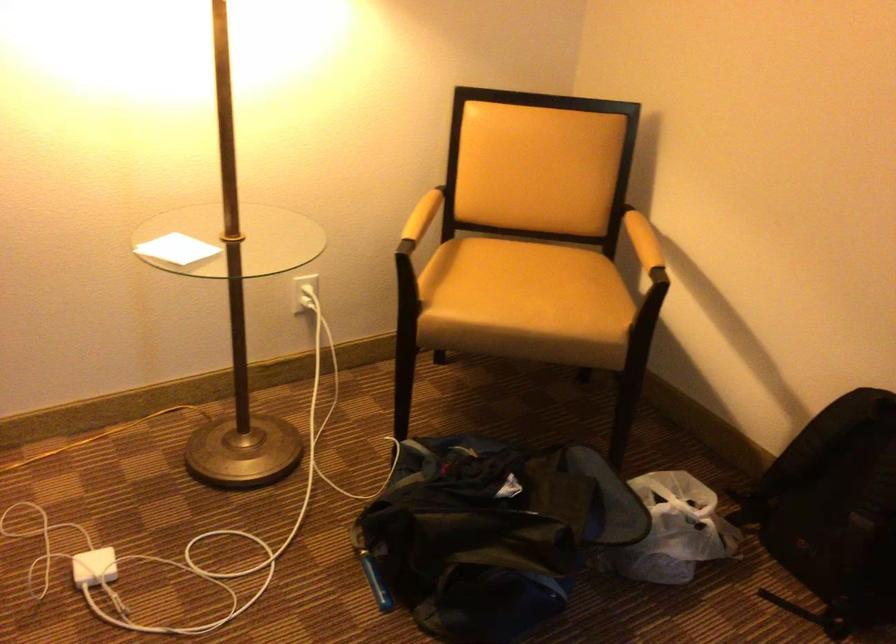
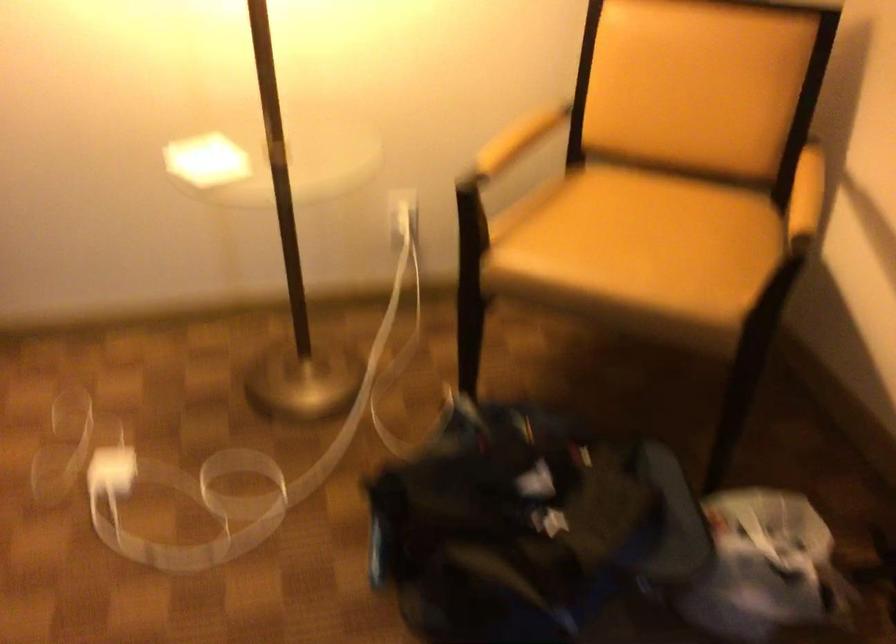
Question: How did the camera likely rotate?

Choices:
 (A) Left
 (B) Right
 (C) Up
 (D) Down

Answer: (A)